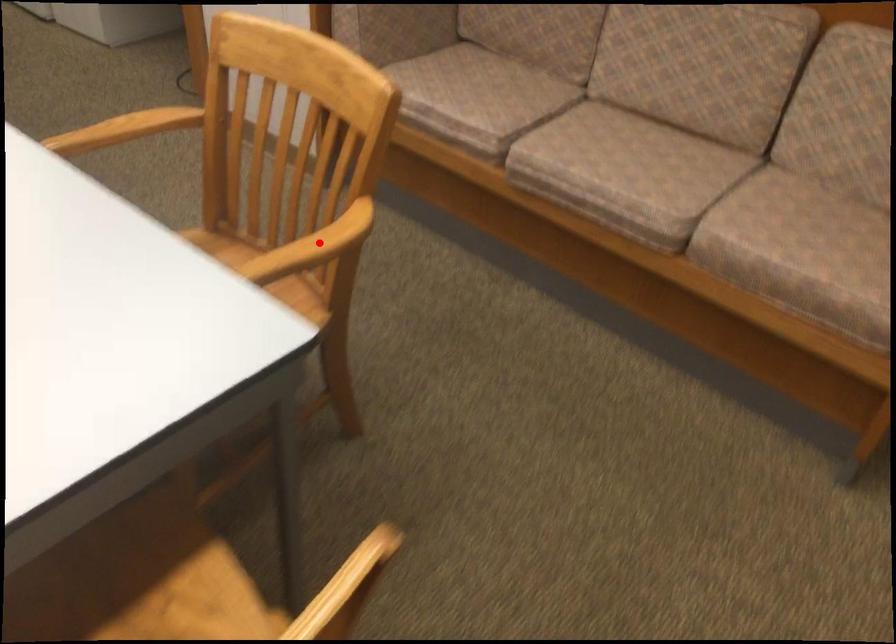
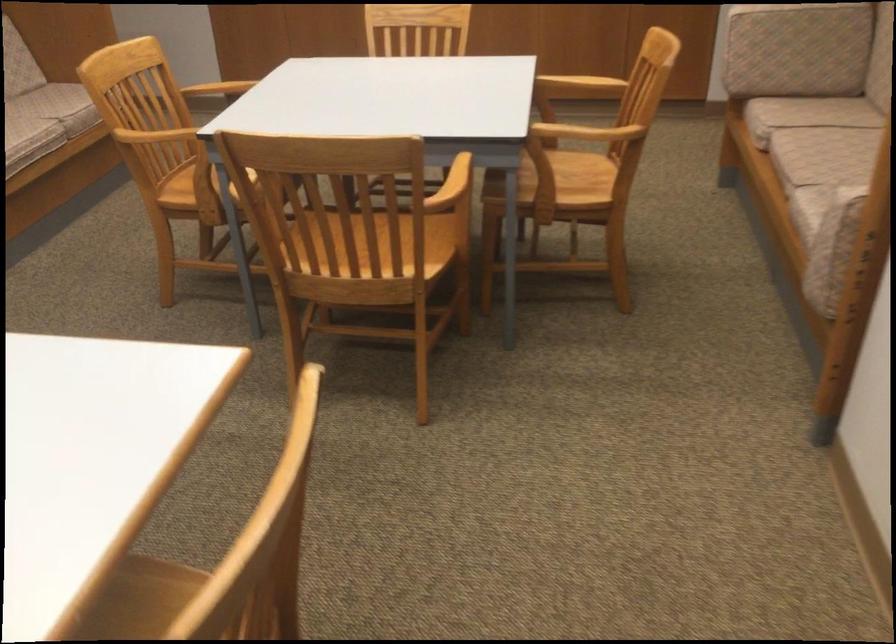
Question: I am providing you with two images of the same scene from different viewpoints. Given a red point in image1, look at the same physical point in image2. Is it:

Choices:
 (A) Closer to the viewpoint
 (B) Farther from the viewpoint

Answer: (B)